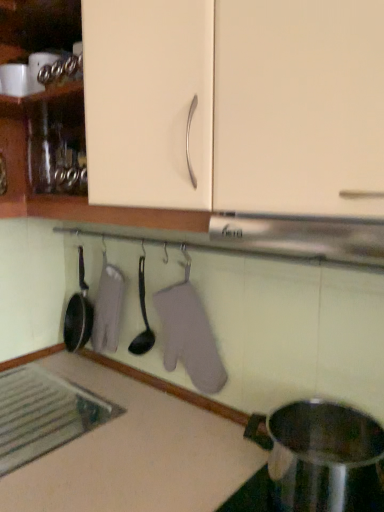
Question: Is black plastic spoon at center beside matte cream cabinet at upper center?

Choices:
 (A) yes
 (B) no

Answer: (B)

Question: Can you confirm if black plastic spoon at center is wider than matte cream cabinet at upper center?

Choices:
 (A) yes
 (B) no

Answer: (B)

Question: Is black plastic spoon at center outside matte cream cabinet at upper center?

Choices:
 (A) no
 (B) yes

Answer: (B)

Question: From a real-world perspective, is black plastic spoon at center beneath matte cream cabinet at upper center?

Choices:
 (A) yes
 (B) no

Answer: (A)

Question: Is black plastic spoon at center positioned far away from matte cream cabinet at upper center?

Choices:
 (A) yes
 (B) no

Answer: (B)

Question: Does black plastic spoon at center have a greater height compared to matte cream cabinet at upper center?

Choices:
 (A) yes
 (B) no

Answer: (B)

Question: From a real-world perspective, does white matte countertop at lower left sit lower than black plastic spoon at center?

Choices:
 (A) yes
 (B) no

Answer: (A)

Question: Are white matte countertop at lower left and black plastic spoon at center located far from each other?

Choices:
 (A) no
 (B) yes

Answer: (A)

Question: Considering the relative sizes of white matte countertop at lower left and black plastic spoon at center in the image provided, is white matte countertop at lower left smaller than black plastic spoon at center?

Choices:
 (A) yes
 (B) no

Answer: (B)

Question: Considering the relative sizes of white matte countertop at lower left and black plastic spoon at center in the image provided, is white matte countertop at lower left wider than black plastic spoon at center?

Choices:
 (A) yes
 (B) no

Answer: (A)

Question: Is white matte countertop at lower left thinner than black plastic spoon at center?

Choices:
 (A) no
 (B) yes

Answer: (A)

Question: Could you tell me if white matte countertop at lower left is facing black plastic spoon at center?

Choices:
 (A) yes
 (B) no

Answer: (B)

Question: Does stainless steel pot at lower right have a greater width compared to matte cream cabinet at upper center?

Choices:
 (A) no
 (B) yes

Answer: (A)